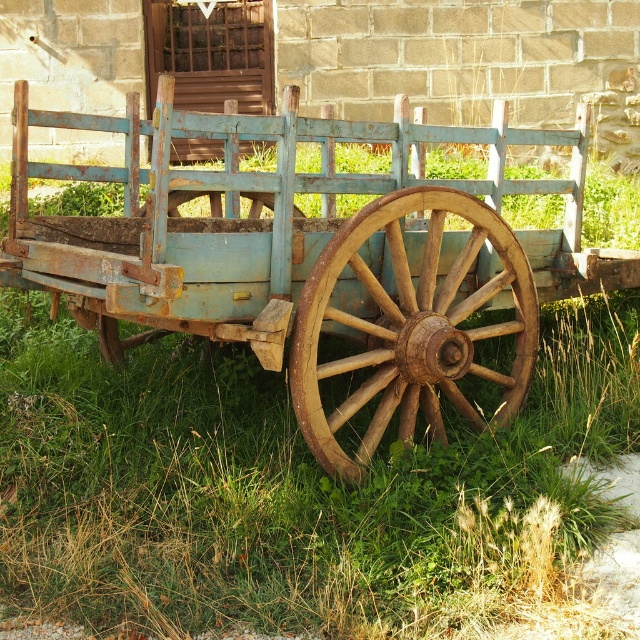
Does rusty wood wagon at center have a lesser width compared to rusty wood wagon wheel at center?

Incorrect, rusty wood wagon at center's width is not less than rusty wood wagon wheel at center's.

I want to click on rusty wood wagon at center, so (x=320, y=264).

The height and width of the screenshot is (640, 640). What are the coordinates of `rusty wood wagon at center` in the screenshot? It's located at (320, 264).